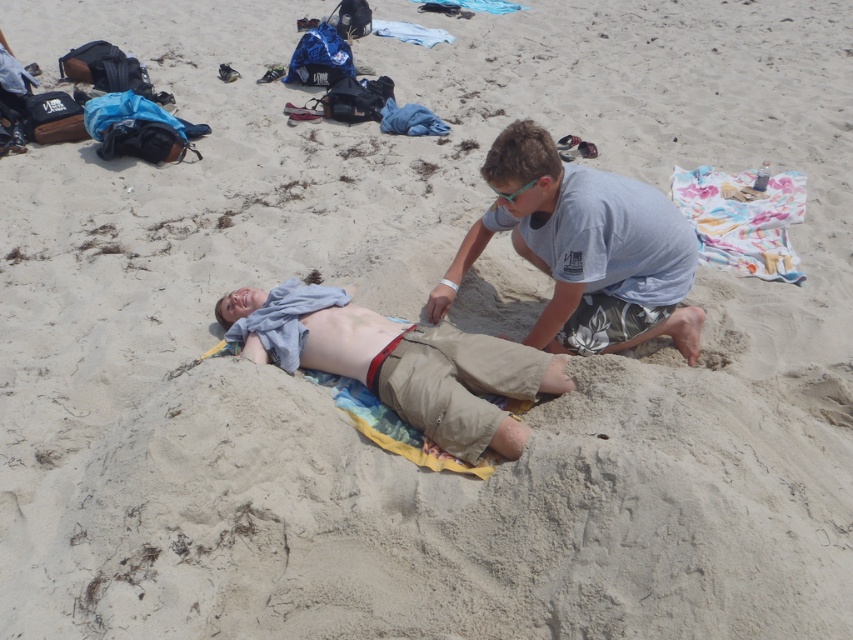
You are standing at the beach and want to retrieve your multicolored fabric towel at upper center. If your average walking speed is 1.5 meters per second, how many seconds will it take you to reach it?

The multicolored fabric towel at upper center is 4.51 meters away. At a speed of 1.5 meters per second, dividing the distance by speed gives approximately 3.01 seconds. So, it will take about 3 seconds to reach the multicolored fabric towel at upper center.

You are a photographer trying to capture a candid shot of the two people at the beach. To ensure both the gray cotton shirt at center and the beige cotton shorts at center are clearly visible in the frame, which one should you focus on first?

You should focus on the gray cotton shirt at center first because the beige cotton shorts at center is behind it, so ensuring the front object is in focus will naturally include the background object in the shot.